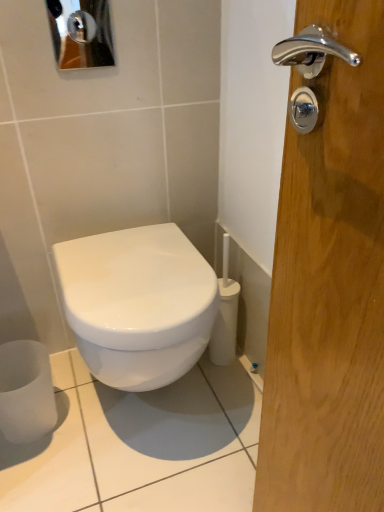
Question: Is metallic reflective mirror at upper left wider than white glossy toilet at center?

Choices:
 (A) yes
 (B) no

Answer: (B)

Question: Are metallic reflective mirror at upper left and white glossy toilet at center beside each other?

Choices:
 (A) yes
 (B) no

Answer: (B)

Question: From the image's perspective, would you say metallic reflective mirror at upper left is positioned over white glossy toilet at center?

Choices:
 (A) no
 (B) yes

Answer: (B)

Question: Does metallic reflective mirror at upper left have a lesser height compared to white glossy toilet at center?

Choices:
 (A) yes
 (B) no

Answer: (A)

Question: From a real-world perspective, does metallic reflective mirror at upper left stand above white glossy toilet at center?

Choices:
 (A) yes
 (B) no

Answer: (A)

Question: Is white glossy toilet at center taller or shorter than metallic reflective mirror at upper left?

Choices:
 (A) short
 (B) tall

Answer: (B)

Question: Considering their positions, is white glossy toilet at center located in front of or behind metallic reflective mirror at upper left?

Choices:
 (A) behind
 (B) front

Answer: (B)

Question: Is point (114, 289) closer or farther from the camera than point (91, 33)?

Choices:
 (A) closer
 (B) farther

Answer: (A)

Question: From a real-world perspective, is white glossy toilet at center above or below metallic reflective mirror at upper left?

Choices:
 (A) above
 (B) below

Answer: (B)

Question: Looking at their shapes, would you say satin white toilet paper at lower left is wider or thinner than white glossy toilet at center?

Choices:
 (A) thin
 (B) wide

Answer: (A)

Question: From a real-world perspective, is satin white toilet paper at lower left positioned above or below white glossy toilet at center?

Choices:
 (A) below
 (B) above

Answer: (A)

Question: Considering the positions of satin white toilet paper at lower left and white glossy toilet at center in the image, is satin white toilet paper at lower left taller or shorter than white glossy toilet at center?

Choices:
 (A) short
 (B) tall

Answer: (A)

Question: Does point (19, 370) appear closer or farther from the camera than point (56, 246)?

Choices:
 (A) closer
 (B) farther

Answer: (B)

Question: Is point (125, 358) closer or farther from the camera than point (44, 411)?

Choices:
 (A) farther
 (B) closer

Answer: (B)

Question: Do you think white glossy toilet at center is within satin white toilet paper at lower left, or outside of it?

Choices:
 (A) outside
 (B) inside

Answer: (A)